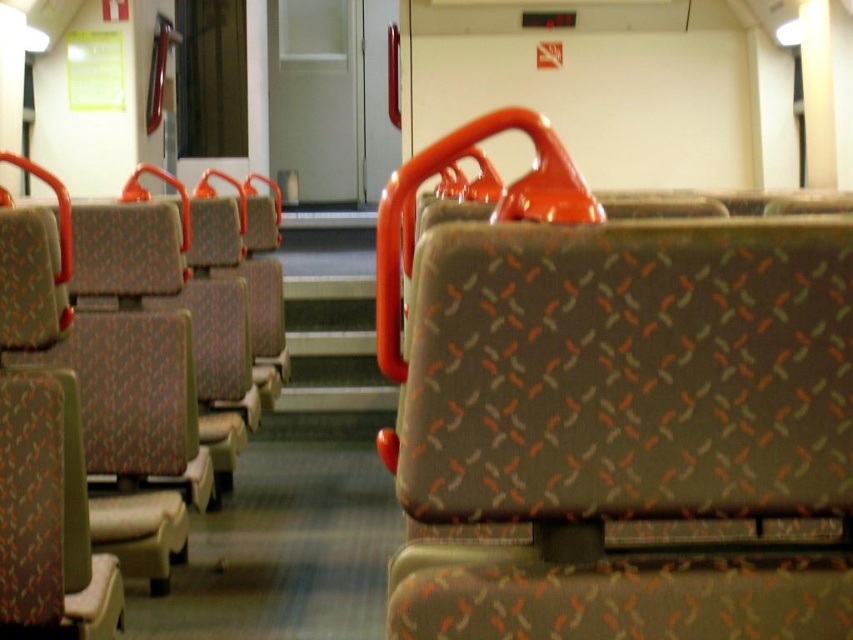
You are a passenger sitting in the train carriage and want to place your bag on the seat in front of you. Which seat should you place your bag on, the textured fabric seat at center or the patterned fabric seat at center?

You should place your bag on the textured fabric seat at center because it is above the patterned fabric seat at center, making it more accessible for you to reach.

You are standing at the origin point in the train carriage. Where is the textured fabric seat at center located in terms of coordinates?

The textured fabric seat at center is located at coordinates 0.634 on the x axis and 0.721 on the y axis.